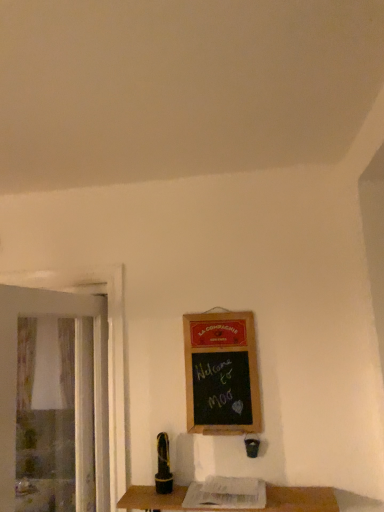
Question: Is transparent plastic screen door at left at the left side of wooden table at lower center?

Choices:
 (A) no
 (B) yes

Answer: (B)

Question: Considering the relative sizes of transparent plastic screen door at left and wooden table at lower center in the image provided, is transparent plastic screen door at left taller than wooden table at lower center?

Choices:
 (A) no
 (B) yes

Answer: (B)

Question: Is wooden table at lower center inside transparent plastic screen door at left?

Choices:
 (A) no
 (B) yes

Answer: (A)

Question: Is transparent plastic screen door at left far from wooden table at lower center?

Choices:
 (A) yes
 (B) no

Answer: (B)

Question: Is transparent plastic screen door at left smaller than wooden table at lower center?

Choices:
 (A) no
 (B) yes

Answer: (A)

Question: Is transparent plastic screen door at left shorter than wooden table at lower center?

Choices:
 (A) yes
 (B) no

Answer: (B)

Question: Is wooden framed chalkboard at center-right positioned behind transparent plastic screen door at left?

Choices:
 (A) no
 (B) yes

Answer: (B)

Question: From the image's perspective, is wooden framed chalkboard at center-right above transparent plastic screen door at left?

Choices:
 (A) yes
 (B) no

Answer: (A)

Question: Can you confirm if wooden framed chalkboard at center-right is smaller than transparent plastic screen door at left?

Choices:
 (A) no
 (B) yes

Answer: (B)

Question: Does wooden framed chalkboard at center-right have a larger size compared to transparent plastic screen door at left?

Choices:
 (A) yes
 (B) no

Answer: (B)

Question: Does wooden framed chalkboard at center-right appear on the left side of transparent plastic screen door at left?

Choices:
 (A) yes
 (B) no

Answer: (B)

Question: Could you tell me if wooden framed chalkboard at center-right is turned towards transparent plastic screen door at left?

Choices:
 (A) no
 (B) yes

Answer: (A)

Question: Does wooden table at lower center contain transparent plastic screen door at left?

Choices:
 (A) no
 (B) yes

Answer: (A)